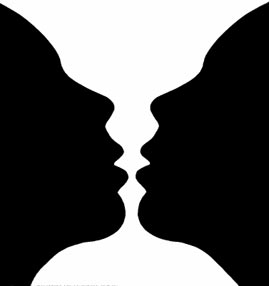
Locate an element on the screen. The height and width of the screenshot is (286, 269). goblet base is located at coordinates (145, 262).